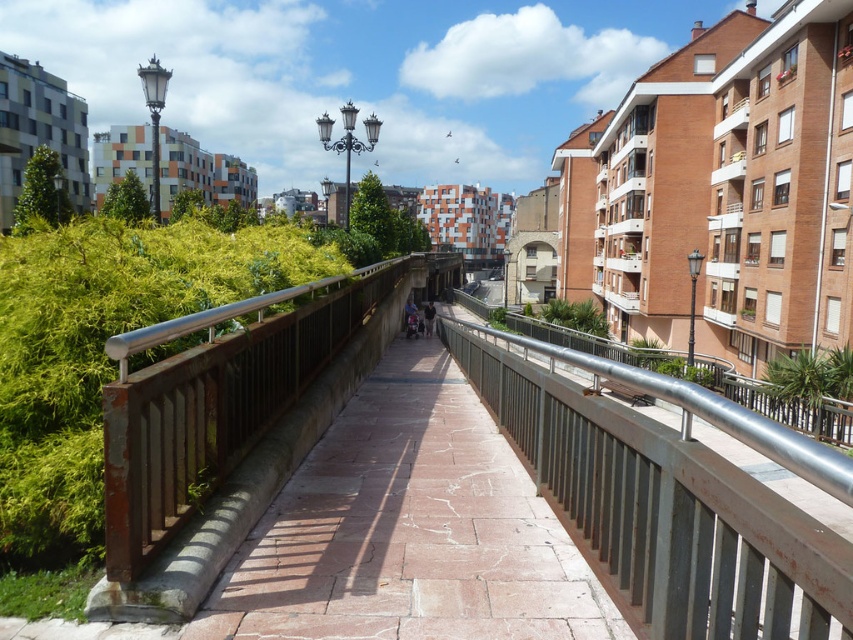
Question: Does metallic silver railing at center appear on the left side of dark gray fabric pants at center?

Choices:
 (A) no
 (B) yes

Answer: (A)

Question: Where is metallic silver railing at center located in relation to dark gray fabric pants at center in the image?

Choices:
 (A) above
 (B) below

Answer: (B)

Question: Is rustic stone walkway at center smaller than rusty wood balustrade at center?

Choices:
 (A) yes
 (B) no

Answer: (A)

Question: Which of the following is the closest to the observer?

Choices:
 (A) metallic silver railing at center
 (B) rusty wood balustrade at center
 (C) dark gray fabric pants at center

Answer: (A)

Question: Among these points, which one is nearest to the camera?

Choices:
 (A) (229, 364)
 (B) (427, 323)
 (C) (599, 480)
 (D) (556, 564)

Answer: (C)

Question: Which of the following is the farthest from the observer?

Choices:
 (A) (132, 566)
 (B) (424, 308)
 (C) (524, 480)
 (D) (833, 577)

Answer: (B)